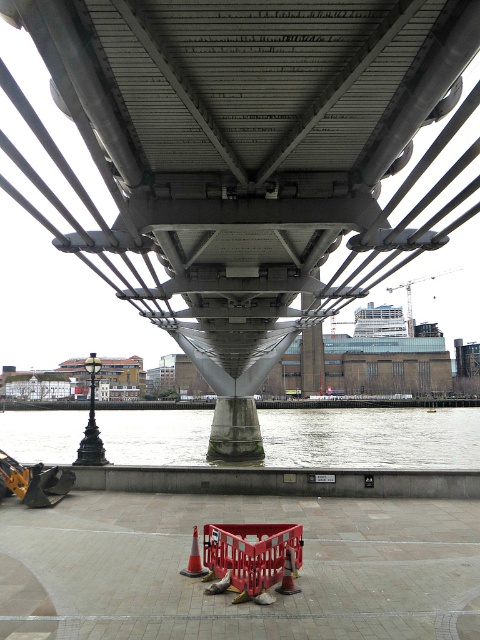
Question: Which of the following is the closest to the observer?

Choices:
 (A) (227, 538)
 (B) (283, 580)

Answer: (B)

Question: Which point is farther from the camera taking this photo?

Choices:
 (A) (294, 566)
 (B) (300, 458)
 (C) (197, 557)

Answer: (B)

Question: Can you confirm if orange plastic traffic cone at center is bigger than orange matte traffic cone at lower center?

Choices:
 (A) no
 (B) yes

Answer: (A)

Question: Does gray concrete water at lower center lie in front of orange plastic traffic cone at center?

Choices:
 (A) yes
 (B) no

Answer: (B)

Question: Which point is closer to the camera taking this photo?

Choices:
 (A) (300, 554)
 (B) (183, 29)
 (C) (291, 572)
 (D) (365, 440)

Answer: (B)

Question: Can you confirm if metallic gray bridge at center is smaller than orange matte traffic cone at lower center?

Choices:
 (A) yes
 (B) no

Answer: (B)